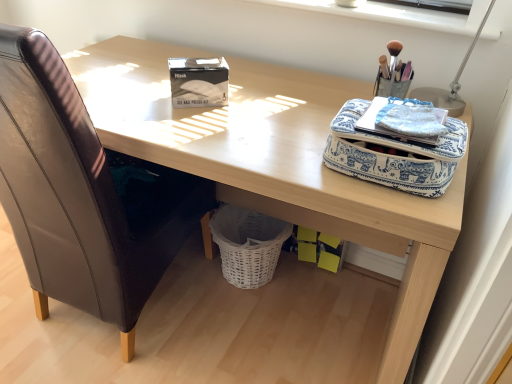
In order to click on free point above blue printed fabric bag at upper right (from a real-world perspective) in this screenshot , I will do `click(400, 113)`.